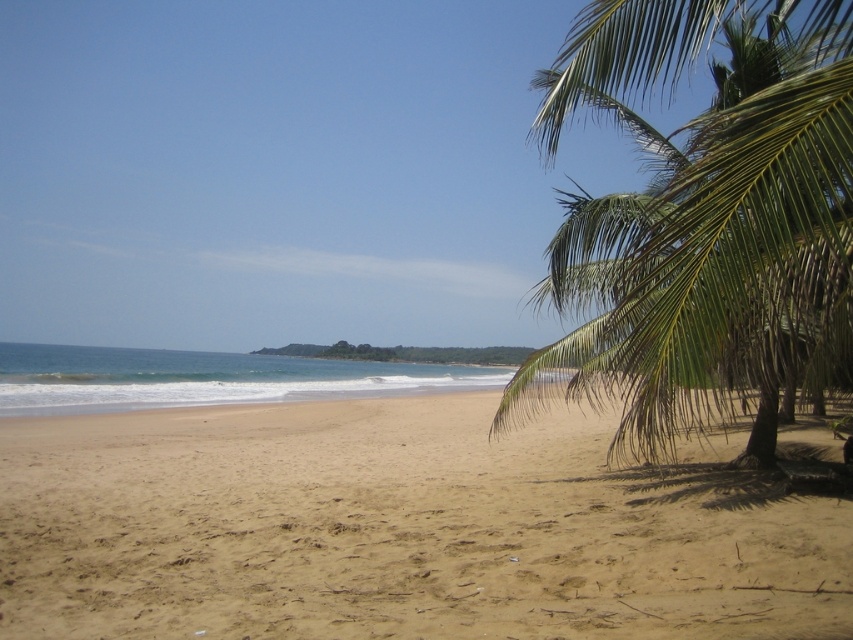
You are standing on the beach and see a point marked at coordinates (399,529). According to the scene, where exactly is this point located?

The point is on the light brown sand at lower center.

Consider the image. You are standing at the center of the beach and want to walk towards the light brown sand at lower center. Based on the coordinates provided, in which direction should you move?

The light brown sand at lower center is located at coordinates point (399, 529). Since the coordinate system likely places the origin at the bottom left corner, moving towards the right and slightly upwards would lead you to the light brown sand at lower center.

You are standing on the beach and looking at the light brown sand at lower center and the green leafy palm tree at right. Which object appears larger in the scene?

The green leafy palm tree at right appears larger than the light brown sand at lower center.